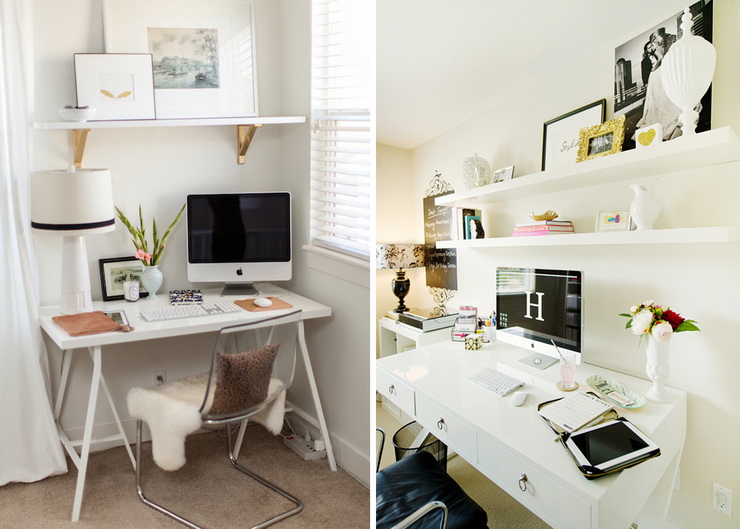
Locate an element on the screen. This screenshot has width=740, height=529. mouse is located at coordinates (252, 297), (518, 389).